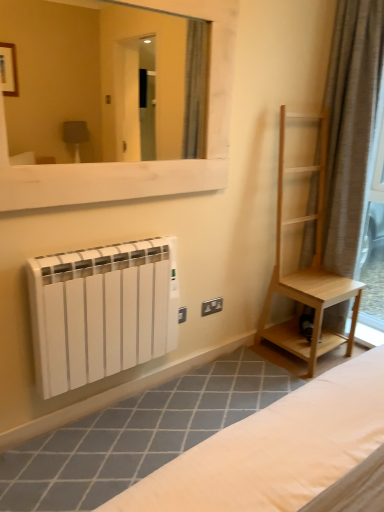
Question: Based on their positions, is brown textured curtain at right located to the left or right of white matte radiator at lower left?

Choices:
 (A) left
 (B) right

Answer: (B)

Question: Would you say brown textured curtain at right is inside or outside white matte radiator at lower left?

Choices:
 (A) outside
 (B) inside

Answer: (A)

Question: Estimate the real-world distances between objects in this image. Which object is closer to the black plastic electric outlet at lower center?

Choices:
 (A) white matte radiator at lower left
 (B) light wood shelf at right
 (C) white wooden mirror at upper center
 (D) brown textured curtain at right
 (E) white matte radiator at lower left

Answer: (B)

Question: Which is nearer to the brown textured curtain at right?

Choices:
 (A) white matte radiator at lower left
 (B) black plastic electric outlet at lower center
 (C) light wood shelf at right
 (D) white matte radiator at lower left
 (E) white wooden mirror at upper center

Answer: (C)